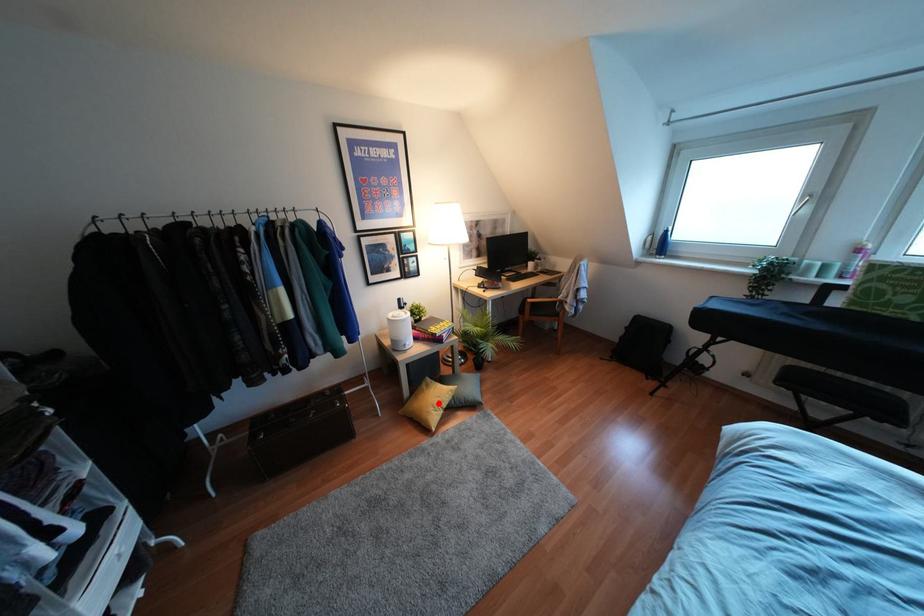
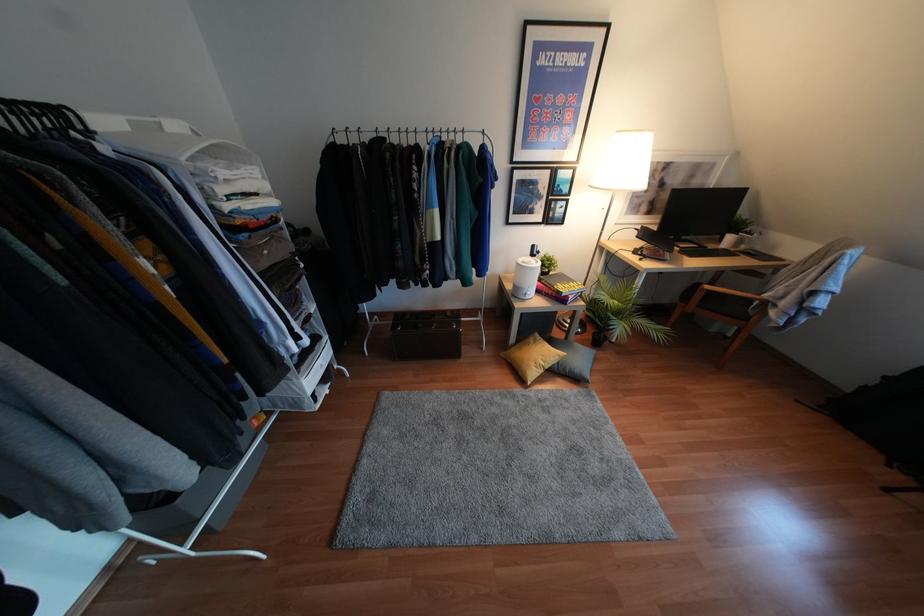
In the second image, find the point that corresponds to the highlighted location in the first image.

(541, 363)